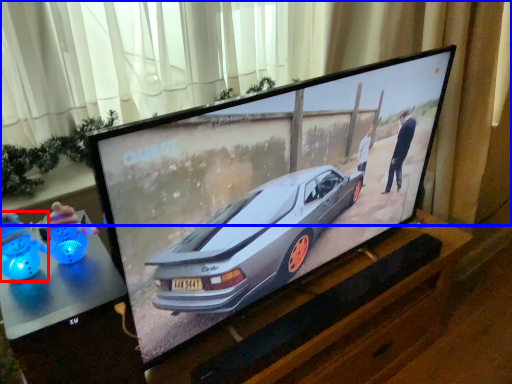
Question: Which of the following is the closest to the observer, toy (highlighted by a red box) or curtain (highlighted by a blue box)?

Choices:
 (A) toy
 (B) curtain

Answer: (A)